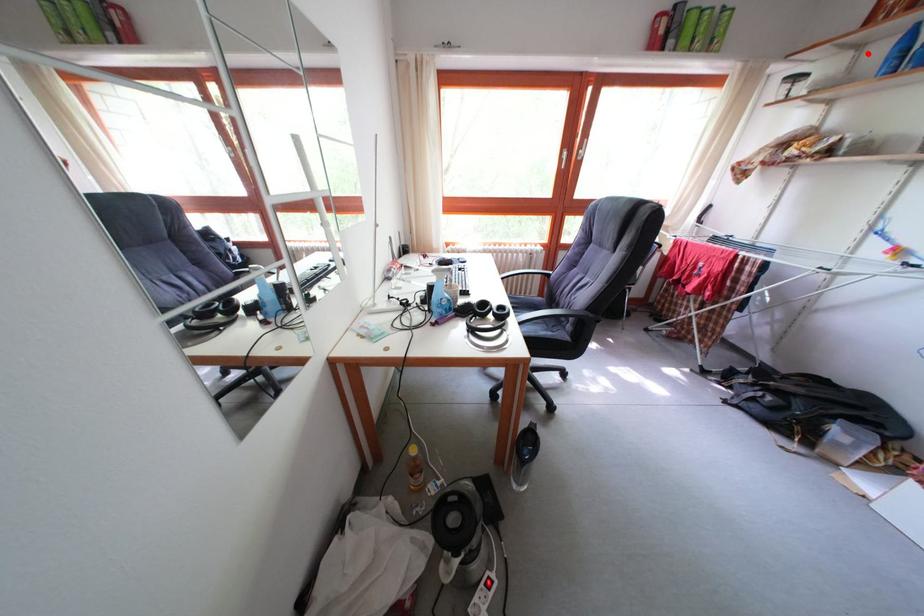
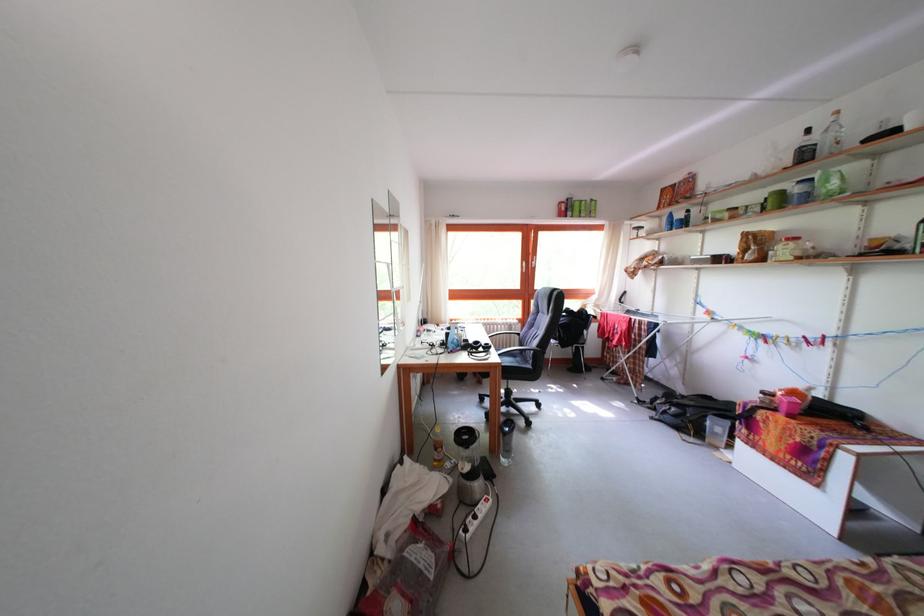
In the second image, find the point that corresponds to the highlighted location in the first image.

(667, 224)